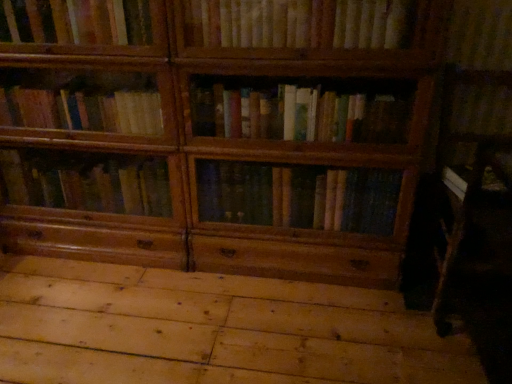
Question: Does wooden bookshelf at upper center appear on the right side of natural wood floor at lower center?

Choices:
 (A) no
 (B) yes

Answer: (B)

Question: Considering the relative sizes of wooden bookshelf at upper center and natural wood floor at lower center in the image provided, is wooden bookshelf at upper center thinner than natural wood floor at lower center?

Choices:
 (A) yes
 (B) no

Answer: (A)

Question: Is wooden bookshelf at upper center not inside natural wood floor at lower center?

Choices:
 (A) no
 (B) yes

Answer: (B)

Question: Is wooden bookshelf at upper center to the left of natural wood floor at lower center from the viewer's perspective?

Choices:
 (A) no
 (B) yes

Answer: (A)

Question: Considering the relative sizes of wooden bookshelf at upper center and natural wood floor at lower center in the image provided, is wooden bookshelf at upper center wider than natural wood floor at lower center?

Choices:
 (A) yes
 (B) no

Answer: (B)

Question: From the image's perspective, is wooden bookshelf at upper center located above natural wood floor at lower center?

Choices:
 (A) yes
 (B) no

Answer: (A)

Question: Is natural wood floor at lower center closer to camera compared to wooden bookshelf at upper center?

Choices:
 (A) no
 (B) yes

Answer: (B)

Question: Is natural wood floor at lower center completely or partially outside of wooden bookshelf at upper center?

Choices:
 (A) yes
 (B) no

Answer: (A)

Question: From a real-world perspective, is natural wood floor at lower center on top of wooden bookshelf at upper center?

Choices:
 (A) no
 (B) yes

Answer: (A)

Question: From the image's perspective, does natural wood floor at lower center appear lower than wooden bookshelf at upper center?

Choices:
 (A) yes
 (B) no

Answer: (A)

Question: Can you see natural wood floor at lower center touching wooden bookshelf at upper center?

Choices:
 (A) no
 (B) yes

Answer: (A)

Question: Can you confirm if natural wood floor at lower center is bigger than wooden bookshelf at upper center?

Choices:
 (A) yes
 (B) no

Answer: (A)

Question: Is natural wood floor at lower center wider or thinner than wooden bookshelf at upper center?

Choices:
 (A) wide
 (B) thin

Answer: (A)